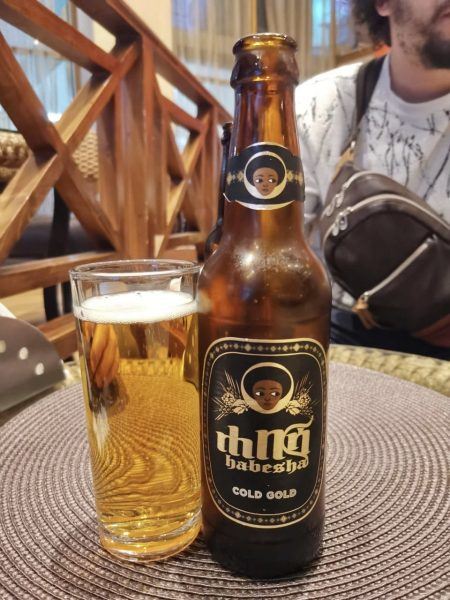
At what (x,y) coordinates should I click in order to perform the action: click on windows. Please return your answer as a coordinate pair (x, y). Looking at the image, I should click on (52, 72), (209, 39), (335, 34).